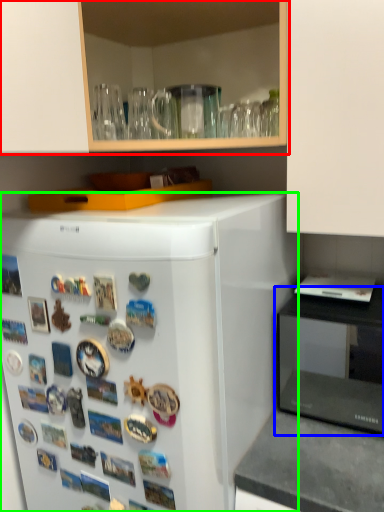
Question: Estimate the real-world distances between objects in this image. Which object is farther from cabinetry (highlighted by a red box), appliance (highlighted by a blue box) or refrigerator (highlighted by a green box)?

Choices:
 (A) appliance
 (B) refrigerator

Answer: (A)